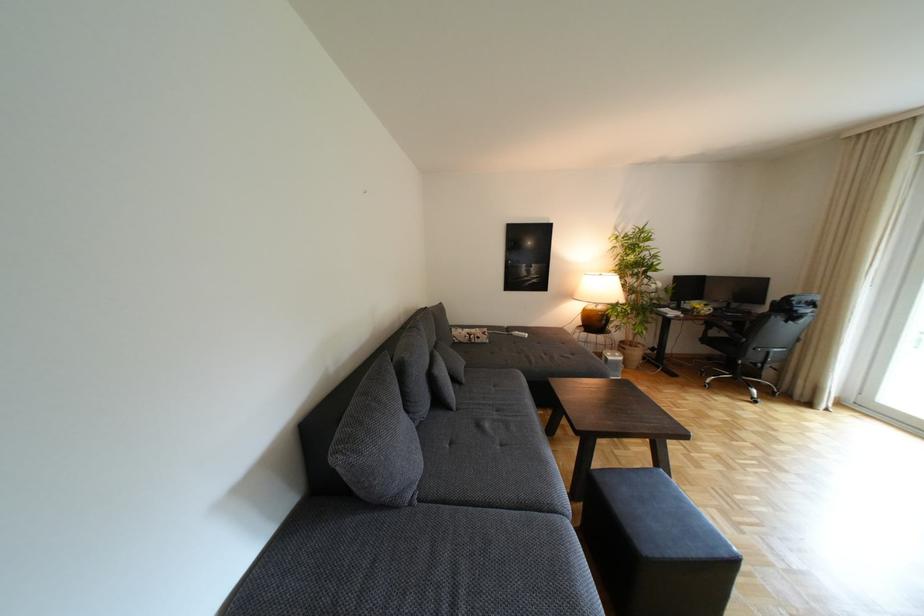
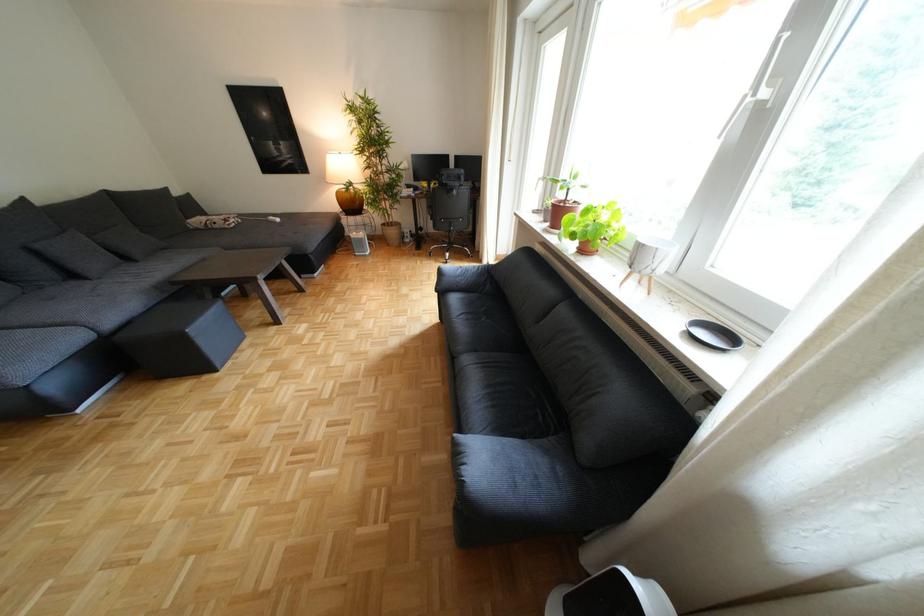
In the second image, find the point that corresponds to the point at 688,379 in the first image.

(430, 252)